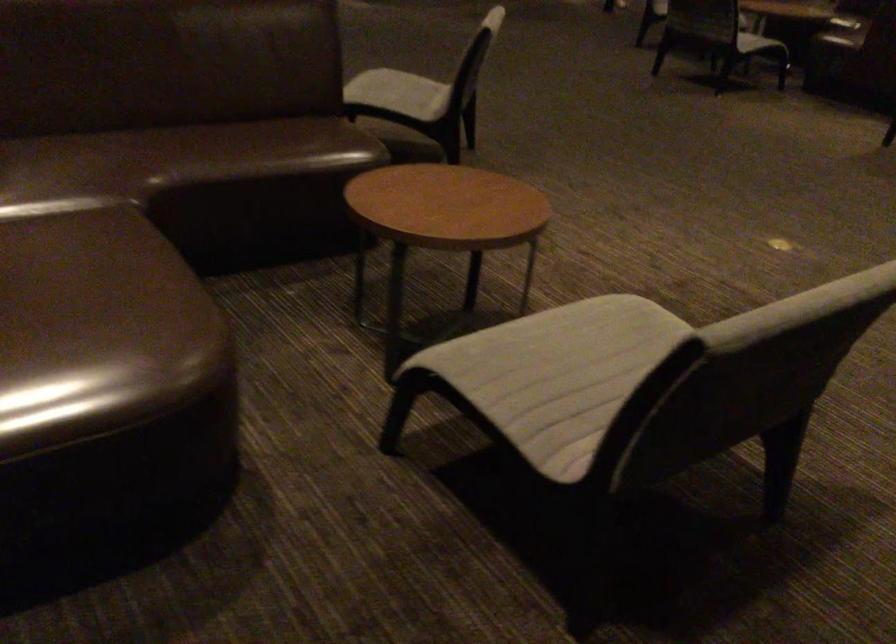
Where is `chair sitting surface`? Image resolution: width=896 pixels, height=644 pixels. chair sitting surface is located at coordinates (557, 374).